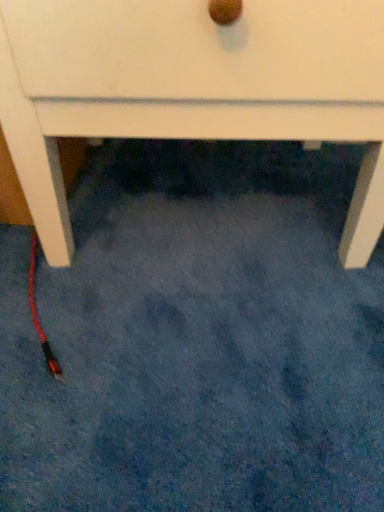
Question: Should I look upward or downward to see red rubber cable at lower left?

Choices:
 (A) down
 (B) up

Answer: (A)

Question: Is red rubber cable at lower left smaller than white matte chest of drawers at center?

Choices:
 (A) yes
 (B) no

Answer: (A)

Question: Are red rubber cable at lower left and white matte chest of drawers at center beside each other?

Choices:
 (A) yes
 (B) no

Answer: (B)

Question: Does red rubber cable at lower left come behind white matte chest of drawers at center?

Choices:
 (A) no
 (B) yes

Answer: (B)

Question: From a real-world perspective, is red rubber cable at lower left on white matte chest of drawers at center?

Choices:
 (A) no
 (B) yes

Answer: (A)

Question: Is the position of red rubber cable at lower left less distant than that of white matte chest of drawers at center?

Choices:
 (A) no
 (B) yes

Answer: (A)

Question: Is red rubber cable at lower left at the left side of white matte chest of drawers at center?

Choices:
 (A) yes
 (B) no

Answer: (A)

Question: Is white matte chest of drawers at center not inside red rubber cable at lower left?

Choices:
 (A) no
 (B) yes

Answer: (B)

Question: Can you confirm if white matte chest of drawers at center is shorter than red rubber cable at lower left?

Choices:
 (A) yes
 (B) no

Answer: (B)

Question: Is white matte chest of drawers at center further to the viewer compared to red rubber cable at lower left?

Choices:
 (A) yes
 (B) no

Answer: (B)

Question: From the image's perspective, is white matte chest of drawers at center located above red rubber cable at lower left?

Choices:
 (A) yes
 (B) no

Answer: (A)

Question: Is white matte chest of drawers at center at the right side of red rubber cable at lower left?

Choices:
 (A) no
 (B) yes

Answer: (B)

Question: From a real-world perspective, is white matte chest of drawers at center positioned over red rubber cable at lower left based on gravity?

Choices:
 (A) no
 (B) yes

Answer: (B)

Question: Considering the positions of red rubber cable at lower left and white matte chest of drawers at center in the image, is red rubber cable at lower left taller or shorter than white matte chest of drawers at center?

Choices:
 (A) short
 (B) tall

Answer: (A)